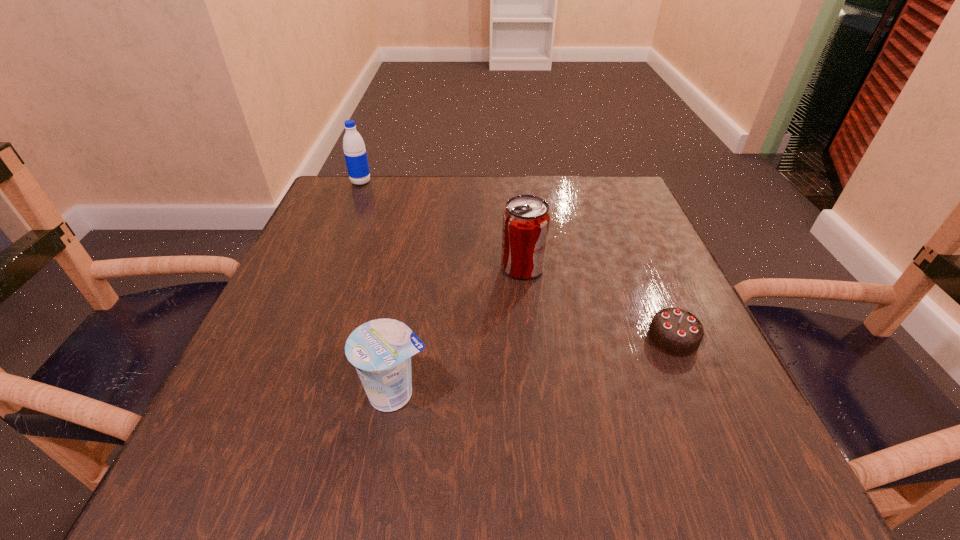
Identify the location of free spot at the far left corner of the desktop. (372, 225).

Identify the location of free location at the far right corner. (605, 193).

This screenshot has width=960, height=540. Find the location of `free space between the shortest object and the second object from right to left`. free space between the shortest object and the second object from right to left is located at coordinates point(598,303).

You are a GUI agent. You are given a task and a screenshot of the screen. Output one action in this format:
    pyautogui.click(x=<x>, y=<y>)
    Task: Click on the free space that is in between the third object from left to right and the chocolate cake
    This screenshot has width=960, height=540.
    Given the screenshot: What is the action you would take?
    pyautogui.click(x=598, y=303)

Find the location of a particular element. Image resolution: width=960 pixels, height=540 pixels. free space between the yogurt and the farthest object is located at coordinates (378, 288).

Where is `empty space between the second farthest object and the nearest object`? The image size is (960, 540). empty space between the second farthest object and the nearest object is located at coordinates (459, 330).

Find the location of `free spot between the leftmost object and the second shortest object`. free spot between the leftmost object and the second shortest object is located at coordinates (378, 288).

Where is `vacant area that lies between the yogurt and the chocolate cake`? The height and width of the screenshot is (540, 960). vacant area that lies between the yogurt and the chocolate cake is located at coordinates (535, 366).

Where is `free space between the rightmost object and the third object from right to left`? This screenshot has width=960, height=540. free space between the rightmost object and the third object from right to left is located at coordinates (535, 366).

The image size is (960, 540). I want to click on vacant space that is in between the shortest object and the nearest object, so click(535, 366).